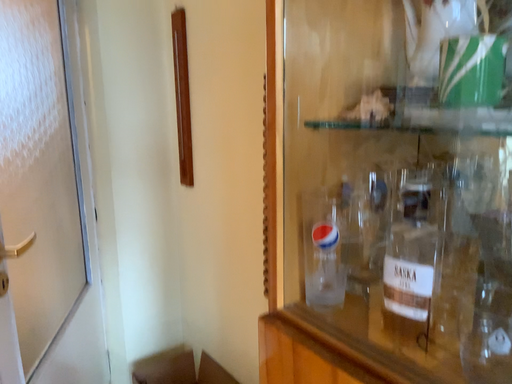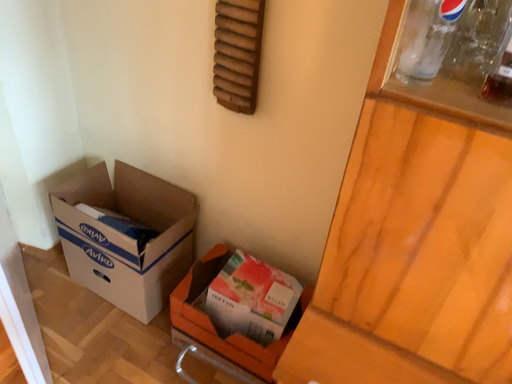
Question: Which way did the camera rotate in the video?

Choices:
 (A) rotated upward
 (B) rotated downward

Answer: (B)